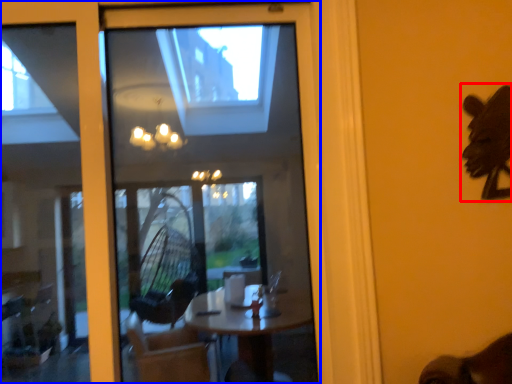
Question: Among these objects, which one is farthest to the camera, animal (highlighted by a red box) or window (highlighted by a blue box)?

Choices:
 (A) animal
 (B) window

Answer: (A)